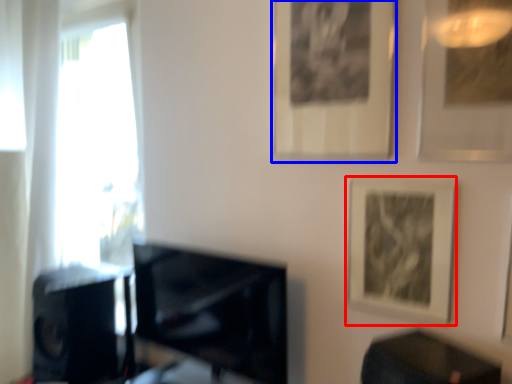
Question: Which object is further to the camera taking this photo, picture frame (highlighted by a red box) or picture frame (highlighted by a blue box)?

Choices:
 (A) picture frame
 (B) picture frame

Answer: (B)